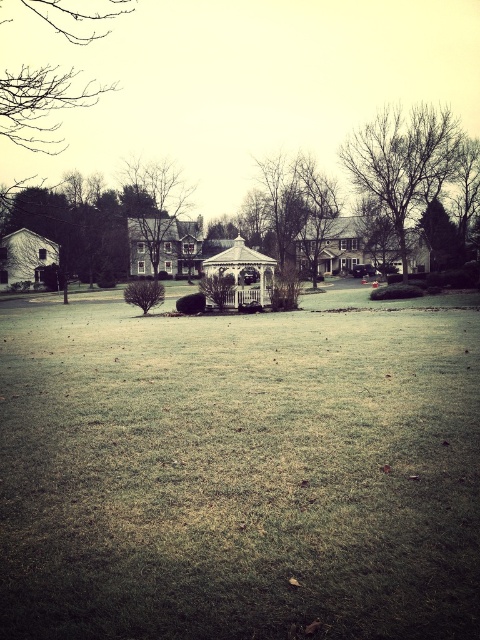
Question: Which point is farther from the camera taking this photo?

Choices:
 (A) (191, 273)
 (B) (376, 157)
 (C) (158, 333)

Answer: (A)

Question: Is bare branches at upper right bigger than white wooden gazebo at center?

Choices:
 (A) yes
 (B) no

Answer: (A)

Question: Estimate the real-world distances between objects in this image. Which object is closer to the bare branches at upper right?

Choices:
 (A) white wooden gazebo at center
 (B) green grass at center

Answer: (A)

Question: Which point is closer to the camera?

Choices:
 (A) (149, 205)
 (B) (274, 392)

Answer: (B)

Question: Is brown wood tree at upper center to the left of white wooden gazebo at center from the viewer's perspective?

Choices:
 (A) no
 (B) yes

Answer: (B)

Question: Is green grass at center to the left of white wooden gazebo at center from the viewer's perspective?

Choices:
 (A) yes
 (B) no

Answer: (A)